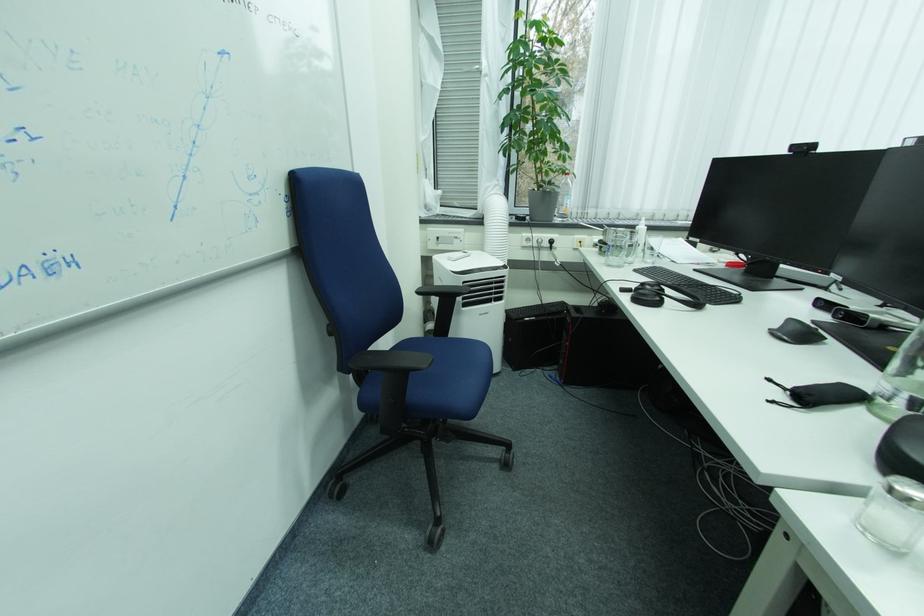
Locate an element on the screen. glass mug handle is located at coordinates (893, 514).